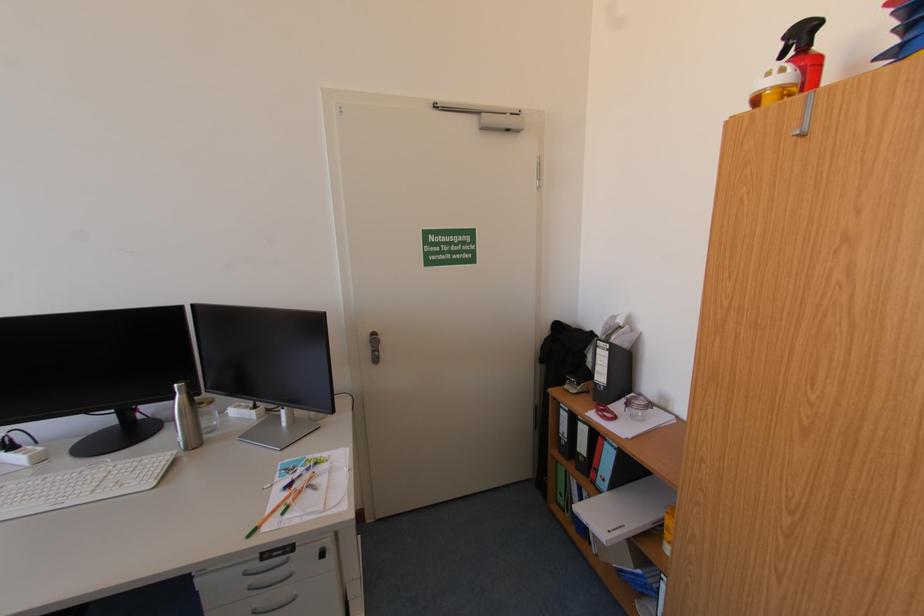
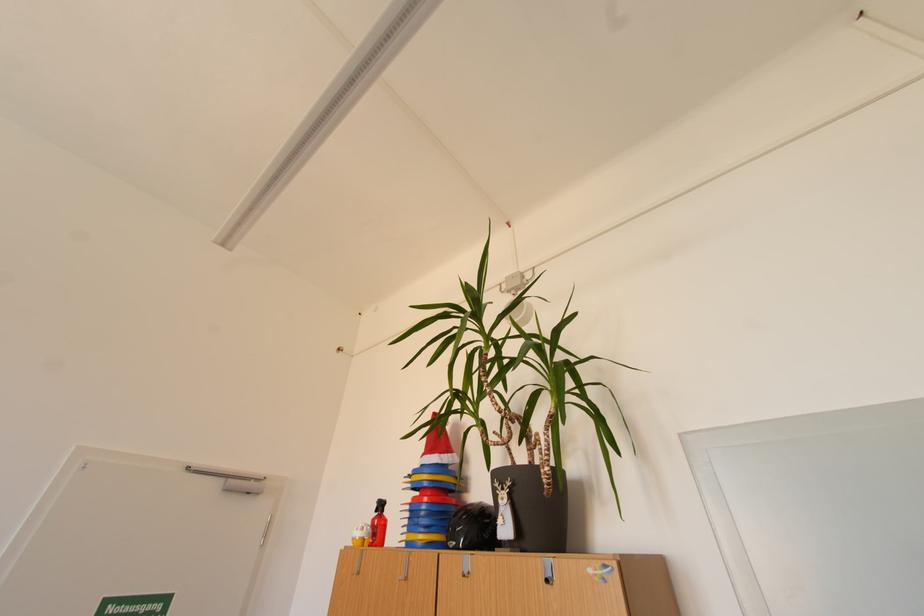
Find the pixel in the second image that matches the point at 796,78 in the first image.

(373, 533)